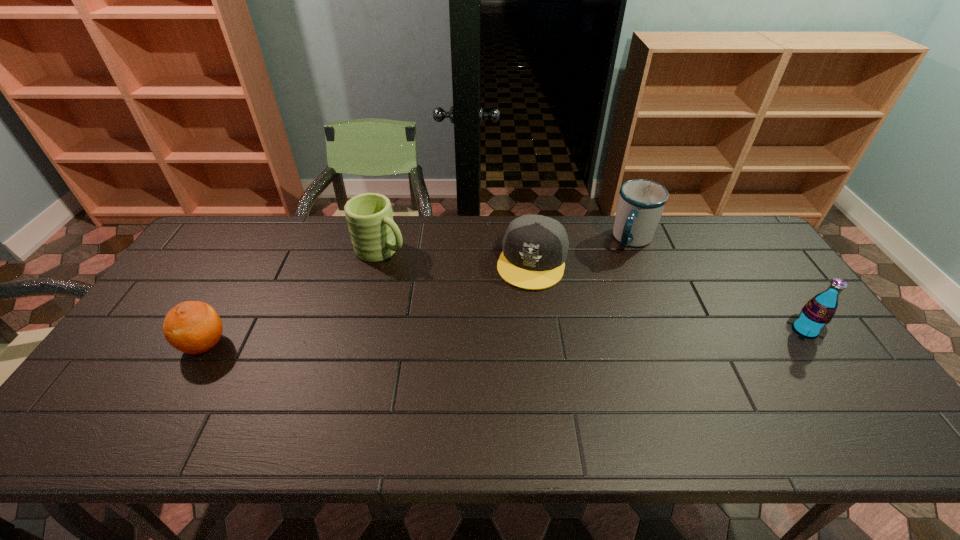
Find the location of a particular element. The image size is (960, 540). free space on the desktop that is between the orange and the rightmost object and is positioned on the front-facing side of the cap is located at coordinates (510, 337).

Find the location of a particular element. The height and width of the screenshot is (540, 960). free space on the desktop that is between the leftmost object and the soda and is positioned on the handle side of the right mug is located at coordinates pos(594,335).

Find the location of a particular element. This screenshot has width=960, height=540. free space on the desktop that is between the orange and the rightmost object and is positioned on the side of the left mug with the handle is located at coordinates (526, 336).